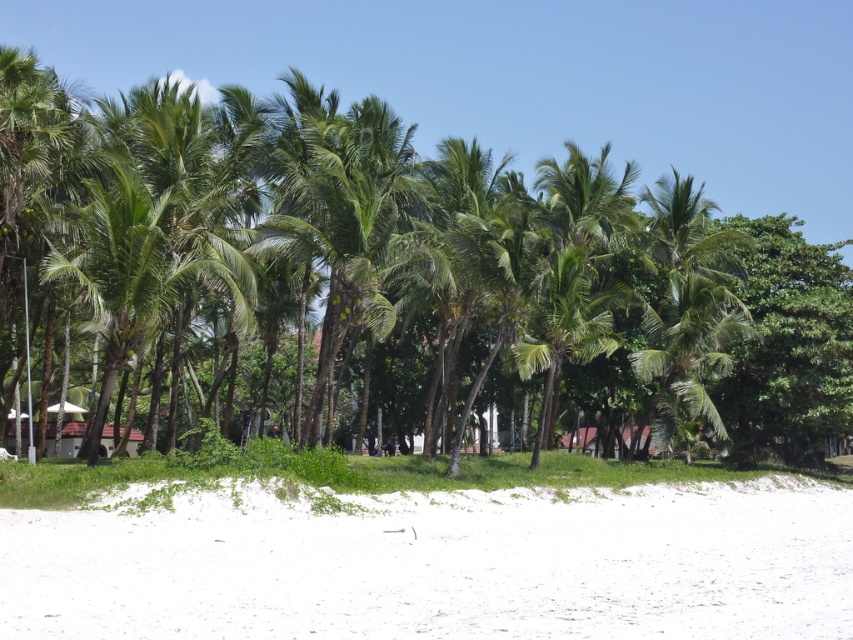
Question: Can you confirm if white sandy beach at lower center is positioned above green leafy palm tree at left?

Choices:
 (A) yes
 (B) no

Answer: (B)

Question: Can you confirm if white sandy beach at lower center is positioned below green leafy palm tree at center?

Choices:
 (A) no
 (B) yes

Answer: (B)

Question: Among these objects, which one is nearest to the camera?

Choices:
 (A) white sandy beach at lower center
 (B) green leafy palm tree at left
 (C) green leafy palm tree at center

Answer: (A)

Question: From the image, what is the correct spatial relationship of white sandy beach at lower center in relation to green leafy palm tree at center?

Choices:
 (A) below
 (B) above

Answer: (A)

Question: Which of these objects is positioned farthest from the green leafy palm tree at center?

Choices:
 (A) white sandy beach at lower center
 (B) green leafy palm tree at left

Answer: (B)

Question: Which is farther from the green leafy palm tree at left?

Choices:
 (A) white sandy beach at lower center
 (B) green leafy palm tree at center

Answer: (B)